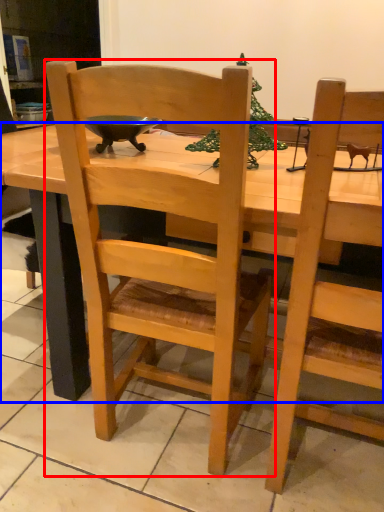
Question: Among these objects, which one is farthest to the camera, chair (highlighted by a red box) or desk (highlighted by a blue box)?

Choices:
 (A) chair
 (B) desk

Answer: (B)